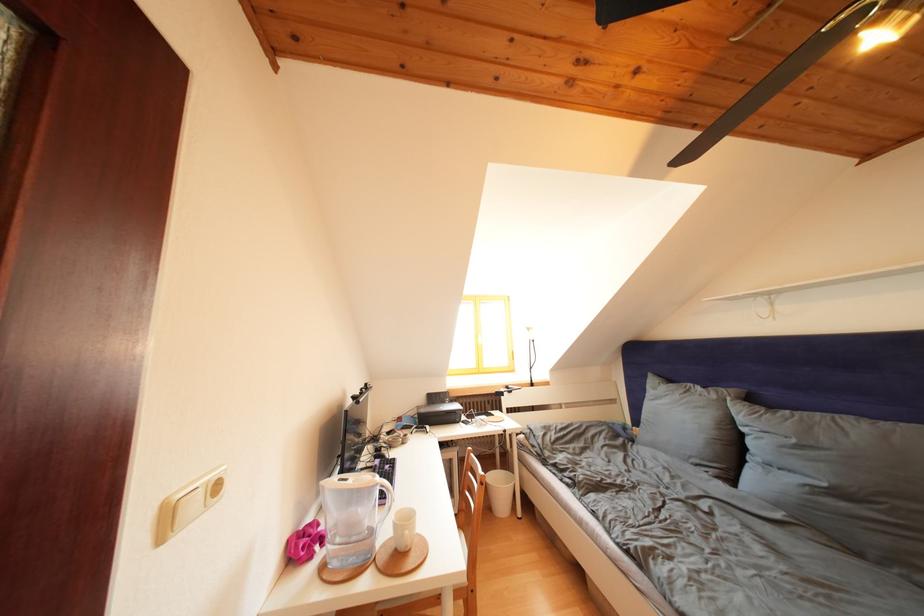
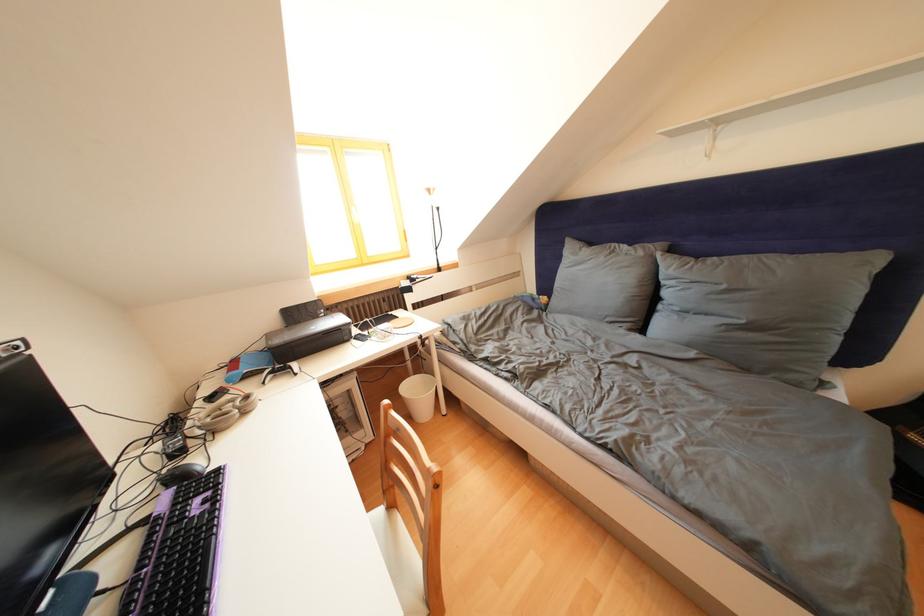
The point at (x=722, y=402) is marked in the first image. Where is the corresponding point in the second image?

(649, 259)